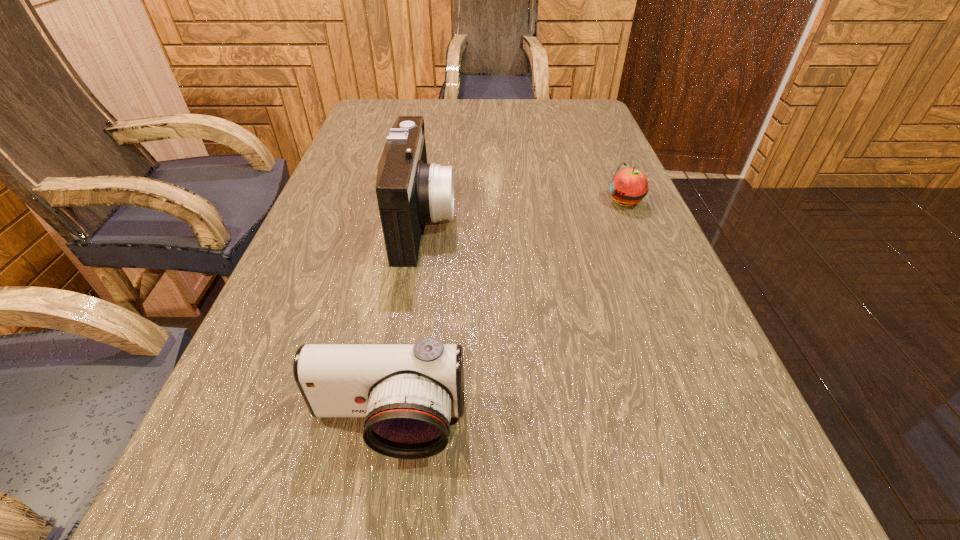
Locate an element on the screen. This screenshot has height=540, width=960. object at the right edge is located at coordinates [629, 186].

This screenshot has width=960, height=540. I want to click on vacant area at the left edge, so click(354, 273).

Identify the location of free space at the right edge. This screenshot has width=960, height=540. (613, 177).

Locate an element on the screen. The height and width of the screenshot is (540, 960). blank area at the far left corner is located at coordinates (406, 106).

Locate an element on the screen. This screenshot has height=540, width=960. free location at the far right corner is located at coordinates (565, 124).

This screenshot has width=960, height=540. I want to click on vacant space that is in between the apple and the shorter camcorder, so click(x=507, y=313).

The image size is (960, 540). Find the location of `vacant area between the nearest object and the rightmost object`. vacant area between the nearest object and the rightmost object is located at coordinates (507, 313).

The image size is (960, 540). I want to click on unoccupied position between the farther camcorder and the shortest object, so click(524, 211).

Image resolution: width=960 pixels, height=540 pixels. Identify the location of free spot between the second tallest object and the tallest object. (406, 323).

Identify the location of free point between the nearer camcorder and the rightmost object. Image resolution: width=960 pixels, height=540 pixels. (507, 313).